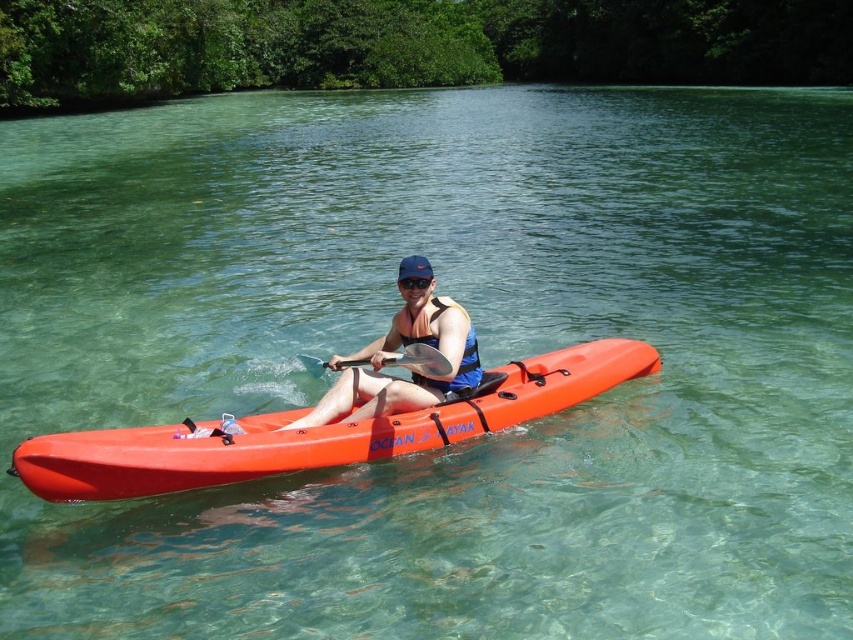
Does matte blue life vest at center appear under wooden paddle at center?

Yes, matte blue life vest at center is below wooden paddle at center.

At what (x,y) coordinates should I click in order to perform the action: click on matte blue life vest at center. Please return your answer as a coordinate pair (x, y). Looking at the image, I should click on (410, 368).

Which is behind, point (403, 385) or point (434, 349)?

Positioned behind is point (403, 385).

This screenshot has height=640, width=853. What are the coordinates of `matte blue life vest at center` in the screenshot? It's located at (410, 368).

Which is in front, point (432, 394) or point (447, 381)?

Positioned in front is point (447, 381).

Who is more forward, (315,412) or (401,340)?

Point (315,412)

The image size is (853, 640). Identify the location of matte blue life vest at center. (410, 368).

Can you confirm if orange plastic kayak at center is thinner than transparent plastic goggles at center?

No.

Does point (259, 426) come behind point (401, 289)?

No.

Is point (84, 445) behind point (413, 285)?

No, (84, 445) is in front of (413, 285).

Locate an element on the screen. orange plastic kayak at center is located at coordinates (316, 432).